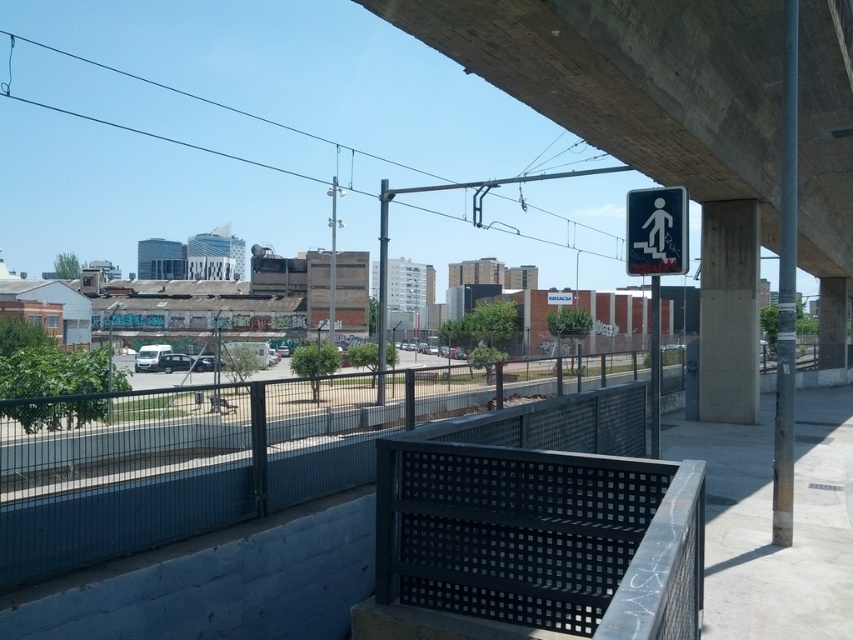
Consider the image. You are a city planner reviewing this urban space. You need to determine if the black perforated metal bench at lower center can accommodate a group of 4 people comfortably. Considering the size of the white plastic pedestrian sign at upper center, can you estimate if the bench is large enough?

The black perforated metal bench at lower center is smaller than the white plastic pedestrian sign at upper center. Since the sign is likely larger than average, the bench may not be sufficient to comfortably seat 4 people.

You are standing at the base of the large concrete overpass and want to reach the point marked as point (x=677, y=100). If your walking speed is 1.5 meters per second, how many seconds will it take you to reach that point?

The point (x=677, y=100) is 10.06 meters away from the viewer. At a walking speed of 1.5 meters per second, it would take approximately 6.7 seconds to reach it.

You are a pedestrian looking to cross the road safely. You see the black perforated metal bench at lower center and the white plastic pedestrian sign at upper center. According to the scene, which object is positioned higher from the ground?

The white plastic pedestrian sign at upper center is positioned higher from the ground than the black perforated metal bench at lower center.